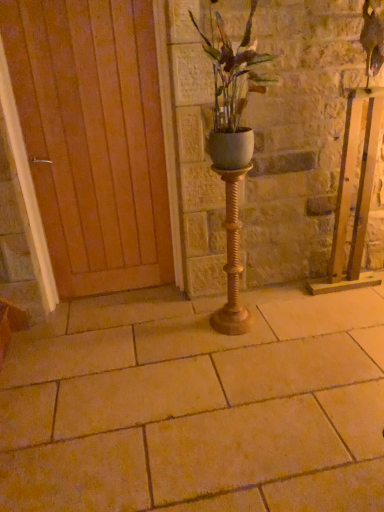
This screenshot has width=384, height=512. I want to click on beige stone pavement at center, so click(197, 406).

What is the approximate height of white matte pot at center?

white matte pot at center is 29.77 inches in height.

I want to click on beige stone pavement at center, so click(x=197, y=406).

Considering the sizes of objects beige stone pavement at center and white matte pot at center in the image provided, who is shorter, beige stone pavement at center or white matte pot at center?

Standing shorter between the two is beige stone pavement at center.

Is the depth of beige stone pavement at center less than that of white matte pot at center?

Yes, beige stone pavement at center is closer to the viewer.

In the scene shown: From a real-world perspective, which is physically above, beige stone pavement at center or white matte pot at center?

white matte pot at center is physically above.

Considering the sizes of objects beige stone pavement at center and wooden at left in the image provided, who is shorter, beige stone pavement at center or wooden at left?

Standing shorter between the two is beige stone pavement at center.

Considering the relative sizes of beige stone pavement at center and wooden at left in the image provided, is beige stone pavement at center wider than wooden at left?

Yes.

Looking at this image, would you consider beige stone pavement at center to be distant from wooden at left?

Yes, beige stone pavement at center and wooden at left are quite far apart.

Can we say beige stone pavement at center lies outside wooden at left?

beige stone pavement at center lies outside wooden at left's area.

Does gold textured candle holder at center appear on the right side of wooden at left?

Correct, you'll find gold textured candle holder at center to the right of wooden at left.

How different are the orientations of gold textured candle holder at center and wooden at left in degrees?

The angle between the facing direction of gold textured candle holder at center and the facing direction of wooden at left is 1.39 degrees.

Is gold textured candle holder at center thinner than wooden at left?

No, gold textured candle holder at center is not thinner than wooden at left.

From the image's perspective, is wooden at left below gold textured candle holder at center?

No.

How many degrees apart are the facing directions of wooden at left and gold textured candle holder at center?

The angular difference between wooden at left and gold textured candle holder at center is 1.39 degrees.

Is wooden at left in front of or behind gold textured candle holder at center in the image?

In the image, wooden at left appears behind gold textured candle holder at center.

From the picture: Which of these two, wooden at left or gold textured candle holder at center, is smaller?

With smaller size is gold textured candle holder at center.

Which is farther from the camera, (154, 116) or (230, 47)?

The point (154, 116) is farther from the camera.

From the image's perspective, would you say wooden at left is shown under white matte pot at center?

Yes, from the image's perspective, wooden at left is below white matte pot at center.

Could white matte pot at center be considered to be inside wooden at left?

Actually, white matte pot at center is outside wooden at left.

Would you say wooden at left is to the left or to the right of white matte pot at center in the picture?

Based on their positions, wooden at left is located to the left of white matte pot at center.

From the picture: Who is taller, white matte pot at center or beige stone pavement at center?

white matte pot at center is taller.

Image resolution: width=384 pixels, height=512 pixels. In order to click on pavement directly beneath the white matte pot at center (from a real-world perspective) in this screenshot , I will do `click(197, 406)`.

Which point is more forward, [217,95] or [296,372]?

Point [217,95]

From the image's perspective, which object appears higher, white matte pot at center or beige stone pavement at center?

white matte pot at center is shown above in the image.

Would you say beige stone pavement at center is inside or outside gold textured candle holder at center?

beige stone pavement at center cannot be found inside gold textured candle holder at center.

Who is smaller, beige stone pavement at center or gold textured candle holder at center?

gold textured candle holder at center.

Looking at this image, can you confirm if beige stone pavement at center is shorter than gold textured candle holder at center?

Yes, beige stone pavement at center is shorter than gold textured candle holder at center.

Consider the image. Can you confirm if beige stone pavement at center is positioned to the left of gold textured candle holder at center?

Incorrect, beige stone pavement at center is not on the left side of gold textured candle holder at center.

Where is `houseplant that is above the beige stone pavement at center (from the image's perspective)`? The image size is (384, 512). houseplant that is above the beige stone pavement at center (from the image's perspective) is located at coordinates [x=233, y=93].

The image size is (384, 512). Find the location of `door on the left of beige stone pavement at center`. door on the left of beige stone pavement at center is located at coordinates (93, 138).

Based on their spatial positions, is gold textured candle holder at center or beige stone pavement at center closer to wooden at left?

Based on the image, gold textured candle holder at center appears to be nearer to wooden at left.

When comparing their distances from white matte pot at center, does wooden at left or gold textured candle holder at center seem closer?

gold textured candle holder at center lies closer to white matte pot at center than the other object.

Based on their spatial positions, is beige stone pavement at center or white matte pot at center closer to wooden at left?

white matte pot at center is closer to wooden at left.

From the image, which object appears to be nearer to gold textured candle holder at center, beige stone pavement at center or wooden at left?

beige stone pavement at center is positioned closer to the anchor gold textured candle holder at center.

Which object lies nearer to the anchor point wooden at left, white matte pot at center or beige stone pavement at center?

Based on the image, white matte pot at center appears to be nearer to wooden at left.

Based on the photo, considering their positions, is wooden at left positioned closer to gold textured candle holder at center than white matte pot at center?

Based on the image, white matte pot at center appears to be nearer to gold textured candle holder at center.

Considering their positions, is gold textured candle holder at center positioned closer to white matte pot at center than wooden at left?

gold textured candle holder at center.

From the picture: Considering their positions, is wooden at left positioned further to beige stone pavement at center than white matte pot at center?

white matte pot at center.

The width and height of the screenshot is (384, 512). I want to click on candle holder between wooden at left and white matte pot at center from left to right, so click(x=232, y=260).

Where is `candle holder between white matte pot at center and beige stone pavement at center vertically`? This screenshot has width=384, height=512. candle holder between white matte pot at center and beige stone pavement at center vertically is located at coordinates (232, 260).

Identify the location of candle holder between wooden at left and beige stone pavement at center vertically. (232, 260).

Image resolution: width=384 pixels, height=512 pixels. Find the location of `door that lies between white matte pot at center and beige stone pavement at center from top to bottom`. door that lies between white matte pot at center and beige stone pavement at center from top to bottom is located at coordinates click(93, 138).